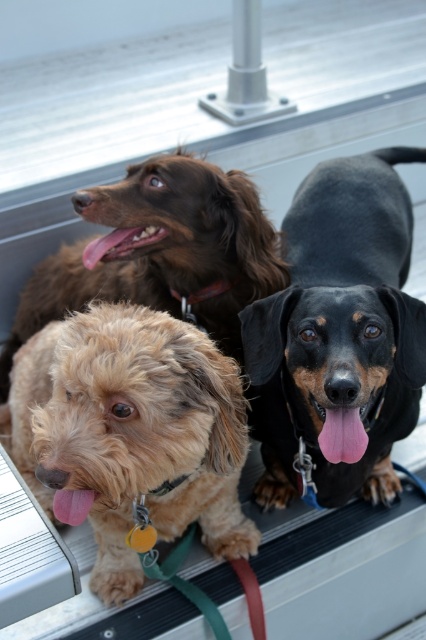
Question: Can you confirm if brown fuzzy dog at upper left is smaller than pink glossy tongue at center?

Choices:
 (A) no
 (B) yes

Answer: (A)

Question: From the image, what is the correct spatial relationship of black smooth dachshund at center in relation to pink glossy tongue at center?

Choices:
 (A) right
 (B) left

Answer: (A)

Question: Among these objects, which one is nearest to the camera?

Choices:
 (A) brown fuzzy dog at upper left
 (B) pink glossy tongue at center
 (C) black smooth dachshund at center
 (D) light brown fur at center

Answer: (D)

Question: Is black smooth dachshund at center positioned behind brown fuzzy dog at upper left?

Choices:
 (A) no
 (B) yes

Answer: (A)

Question: Which of the following is the farthest from the observer?

Choices:
 (A) (377, 298)
 (B) (101, 188)
 (C) (163, 228)
 (D) (144, 340)

Answer: (C)

Question: Which point is closer to the camera?

Choices:
 (A) light brown fur at center
 (B) pink glossy tongue at center
 (C) brown fuzzy dog at upper left

Answer: (A)